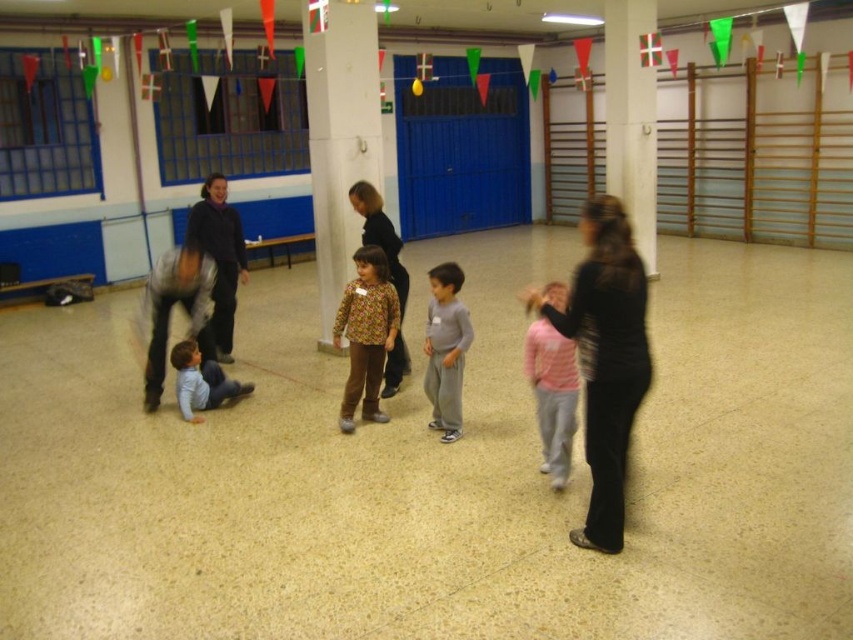
You are standing in the community hall and want to reach the gray matte pants at center. There is a white glossy pillar at upper center blocking your path. Can you walk around it to get to the pants?

The white glossy pillar at upper center is further to the viewer than gray matte pants at center, so the pillar is closer to you. You can walk around the pillar to reach the gray matte pants at center.

You are organizing a small event in this community hall and need to place a 1.2 meter wide table between the white glossy pillar at center and the gray matte pants at center. Is there enough space between them to fit the table?

The white glossy pillar at center is larger in size compared to the gray matte pants at center. However, without specific distance information between them, it is impossible to determine if the 1.2 meter wide table can fit. Additional measurements are needed.